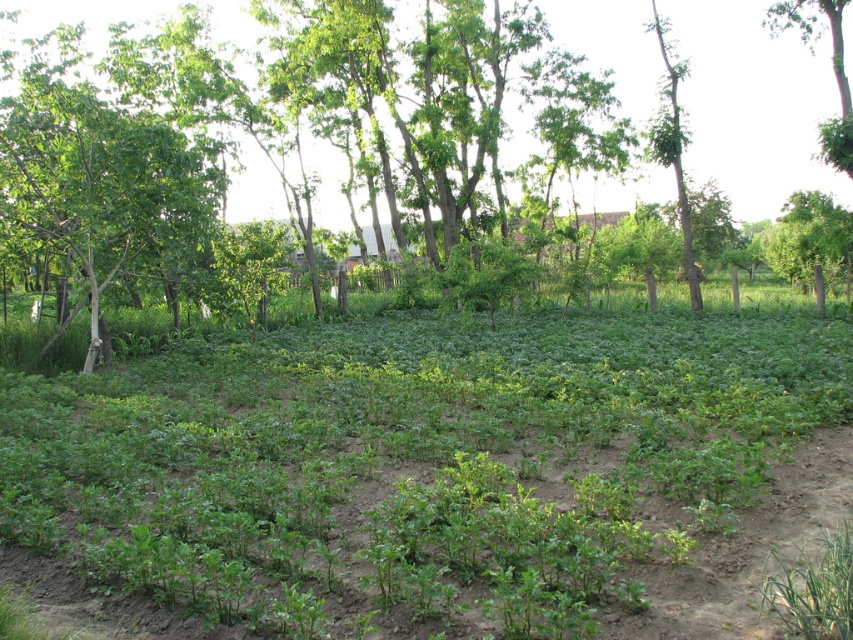
Question: Which point appears closest to the camera in this image?

Choices:
 (A) (827, 1)
 (B) (323, 180)
 (C) (670, 76)

Answer: (A)

Question: Is green leafy tree at center to the right of green leafy tree at upper right from the viewer's perspective?

Choices:
 (A) no
 (B) yes

Answer: (A)

Question: Which of the following is the closest to the observer?

Choices:
 (A) green leafy tree at upper right
 (B) green leafy tree at center
 (C) green rough bark tree at upper right

Answer: (A)

Question: Can you confirm if green leafy tree at center is smaller than green leafy tree at upper right?

Choices:
 (A) yes
 (B) no

Answer: (B)

Question: Does green leafy tree at upper right have a smaller size compared to green rough bark tree at upper right?

Choices:
 (A) yes
 (B) no

Answer: (B)

Question: Which point appears farthest from the camera in this image?

Choices:
 (A) (833, 17)
 (B) (62, 1)

Answer: (B)